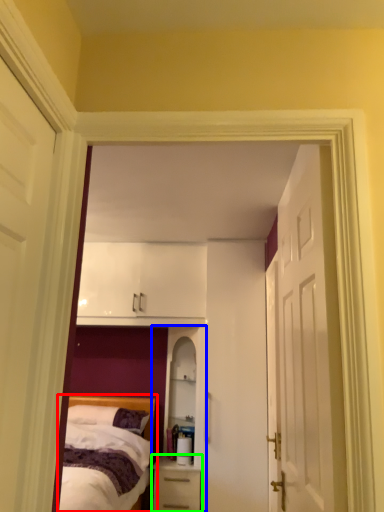
Question: Which is farther away from bed (highlighted by a red box)? dresser (highlighted by a blue box) or nightstand (highlighted by a green box)?

Choices:
 (A) dresser
 (B) nightstand

Answer: (A)